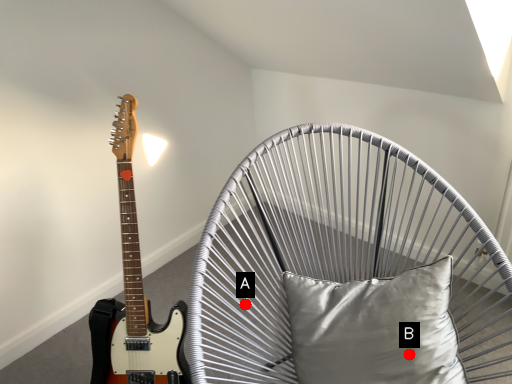
Question: Two points are circled on the image, labeled by A and B beside each circle. Among these points, which one is nearest to the camera?

Choices:
 (A) A is closer
 (B) B is closer

Answer: (B)